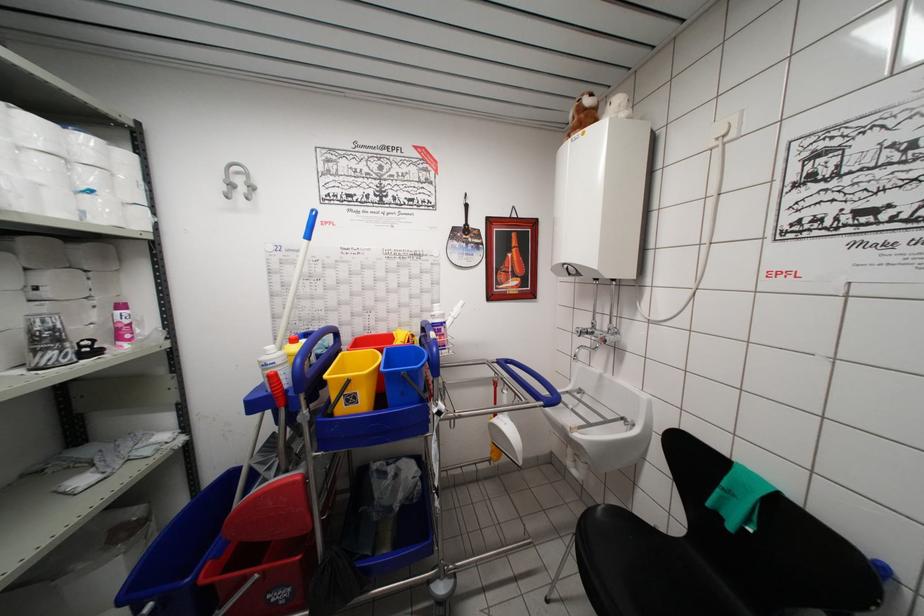
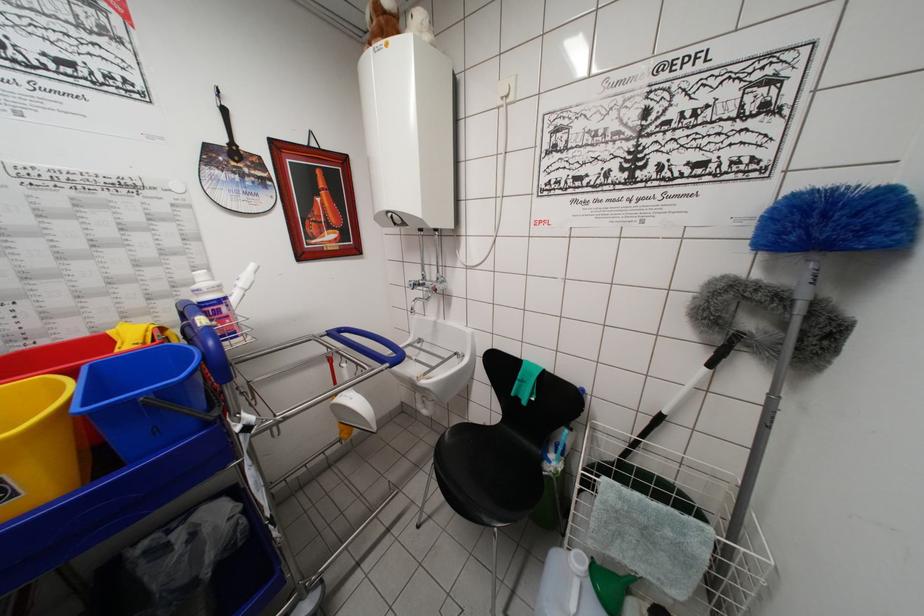
Where in the second image is the point corresponding to pixel 360 408 from the first image?

(20, 500)